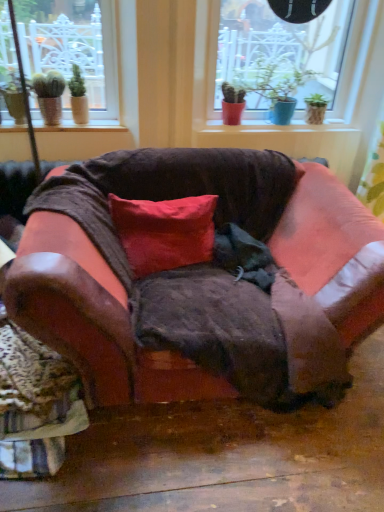
Identify the location of leather couch at center. This screenshot has width=384, height=512. (200, 280).

The height and width of the screenshot is (512, 384). Find the location of `smooth ceramic pots at center, marked as the 1th window sill in a right-to-left arrangement`. smooth ceramic pots at center, marked as the 1th window sill in a right-to-left arrangement is located at coordinates (272, 128).

Where is `leather couch at center`? leather couch at center is located at coordinates (200, 280).

Consider the image. Would you say leather couch at center is inside or outside red cotton pillow at center?

leather couch at center is located beyond the bounds of red cotton pillow at center.

Which is more to the right, leather couch at center or red cotton pillow at center?

From the viewer's perspective, leather couch at center appears more on the right side.

Is leather couch at center with red cotton pillow at center?

No, leather couch at center is not beside red cotton pillow at center.

How different are the orientations of leather couch at center and red cotton pillow at center in degrees?

7.29 degrees separate the facing orientations of leather couch at center and red cotton pillow at center.

Can you confirm if red cotton pillow at center is thinner than matte brown pot at upper left?

In fact, red cotton pillow at center might be wider than matte brown pot at upper left.

This screenshot has width=384, height=512. Identify the location of houseplant on the left of red cotton pillow at center. (78, 97).

How much distance is there between red cotton pillow at center and matte brown pot at upper left?

A distance of 32.49 inches exists between red cotton pillow at center and matte brown pot at upper left.

Does red cotton pillow at center have a smaller size compared to matte brown pot at upper left?

Actually, red cotton pillow at center might be larger than matte brown pot at upper left.

From a real-world perspective, who is located lower, smooth wood window sill at upper left, arranged as the 2th window sill when viewed from the back, or leather-like fabric swivel chair at lower left?

leather-like fabric swivel chair at lower left, from a real-world perspective.

Is smooth wood window sill at upper left, which is the first window sill in front-to-back order, surrounding leather-like fabric swivel chair at lower left?

No, leather-like fabric swivel chair at lower left is located outside of smooth wood window sill at upper left, which is the first window sill in front-to-back order.

Relative to leather-like fabric swivel chair at lower left, is smooth wood window sill at upper left, the 1th window sill in the left-to-right sequence, in front or behind?

In the image, smooth wood window sill at upper left, the 1th window sill in the left-to-right sequence, appears behind leather-like fabric swivel chair at lower left.

Could you measure the distance between smooth wood window sill at upper left, which is the first window sill in front-to-back order, and leather-like fabric swivel chair at lower left?

smooth wood window sill at upper left, which is the first window sill in front-to-back order, is 1.21 meters away from leather-like fabric swivel chair at lower left.

Does point (57, 446) lie in front of point (84, 99)?

Yes, point (57, 446) is closer to viewer.

Would you say matte brown pot at upper left is part of leather-like fabric swivel chair at lower left's contents?

No, leather-like fabric swivel chair at lower left does not contain matte brown pot at upper left.

Between leather-like fabric swivel chair at lower left and matte brown pot at upper left, which one has more height?

With more height is matte brown pot at upper left.

Does leather-like fabric swivel chair at lower left turn towards matte brown pot at upper left?

No, leather-like fabric swivel chair at lower left does not turn towards matte brown pot at upper left.

Looking at this image, which point is more forward, [240,83] or [43,355]?

The point [43,355] is closer to the camera.

I want to click on plant above the leather-like fabric swivel chair at lower left (from a real-world perspective), so click(x=271, y=87).

Does matte red pot at center have a larger size compared to leather-like fabric swivel chair at lower left?

Actually, matte red pot at center might be smaller than leather-like fabric swivel chair at lower left.

Is matte red pot at center inside the boundaries of leather-like fabric swivel chair at lower left, or outside?

matte red pot at center exists outside the volume of leather-like fabric swivel chair at lower left.

Is leather-like fabric swivel chair at lower left at the left side of smooth wood window sill at upper left, the 1th window sill in the left-to-right sequence?

No.

Is leather-like fabric swivel chair at lower left facing away from smooth wood window sill at upper left, the 1th window sill in the left-to-right sequence?

That's not correct — leather-like fabric swivel chair at lower left is not looking away from smooth wood window sill at upper left, the 1th window sill in the left-to-right sequence.

From the image's perspective, who appears lower, leather-like fabric swivel chair at lower left or smooth wood window sill at upper left, which is the first window sill in front-to-back order?

From the image's view, leather-like fabric swivel chair at lower left is below.

Who is taller, leather-like fabric swivel chair at lower left or smooth wood window sill at upper left, the 2th window sill from the right?

leather-like fabric swivel chair at lower left.

Based on their sizes in the image, would you say leather couch at center is bigger or smaller than matte brown pot at upper left?

Considering their sizes, leather couch at center takes up more space than matte brown pot at upper left.

From a real-world perspective, is leather couch at center physically located above or below matte brown pot at upper left?

leather couch at center is below matte brown pot at upper left.

Where is `houseplant to the left of leather couch at center`? This screenshot has width=384, height=512. houseplant to the left of leather couch at center is located at coordinates (78, 97).

There is a leather couch at center. Identify the location of pillow above it (from a real-world perspective). The width and height of the screenshot is (384, 512). (164, 232).

Image resolution: width=384 pixels, height=512 pixels. I want to click on pillow below the matte brown pot at upper left (from a real-world perspective), so click(164, 232).

Based on their spatial positions, is leather-like fabric swivel chair at lower left or smooth ceramic pots at center, which appears as the 2th window sill when viewed from the front, closer to leather couch at center?

leather-like fabric swivel chair at lower left is closer to leather couch at center.

Considering their positions, is matte brown pot at upper left positioned further to red cotton pillow at center than leather-like fabric swivel chair at lower left?

matte brown pot at upper left.

Considering their positions, is smooth wood window sill at upper left, the 2th window sill from the right, positioned closer to matte red pot at center than red cotton pillow at center?

smooth wood window sill at upper left, the 2th window sill from the right, is positioned closer to the anchor matte red pot at center.

When comparing their distances from matte red pot at center, does matte brown pot at upper left or red cotton pillow at center seem closer?

red cotton pillow at center lies closer to matte red pot at center than the other object.

From the image, which object appears to be nearer to smooth wood window sill at upper left, arranged as the 2th window sill when viewed from the back, leather-like fabric swivel chair at lower left or matte brown pot at upper left?

Based on the image, matte brown pot at upper left appears to be nearer to smooth wood window sill at upper left, arranged as the 2th window sill when viewed from the back.

Which object lies further to the anchor point leather-like fabric swivel chair at lower left, matte brown pot at upper left or red cotton pillow at center?

Among the two, matte brown pot at upper left is located further to leather-like fabric swivel chair at lower left.

Which object lies nearer to the anchor point matte brown pot at upper left, smooth wood window sill at upper left, the 2th window sill from the right, or red cotton pillow at center?

smooth wood window sill at upper left, the 2th window sill from the right, is closer to matte brown pot at upper left.

Estimate the real-world distances between objects in this image. Which object is closer to matte brown pot at upper left, smooth ceramic pots at center, which ranks as the second window sill in left-to-right order, or leather couch at center?

smooth ceramic pots at center, which ranks as the second window sill in left-to-right order, is closer to matte brown pot at upper left.

Locate an element on the screen. pillow located between smooth wood window sill at upper left, which is the first window sill in front-to-back order, and matte red pot at center in the left-right direction is located at coordinates (164, 232).

At what (x,y) coordinates should I click in order to perform the action: click on window sill between smooth ceramic pots at center, arranged as the first window sill when viewed from the back, and leather-like fabric swivel chair at lower left from top to bottom. Please return your answer as a coordinate pair (x, y). The height and width of the screenshot is (512, 384). Looking at the image, I should click on (81, 126).

At what (x,y) coordinates should I click in order to perform the action: click on houseplant located between leather couch at center and smooth ceramic pots at center, marked as the 1th window sill in a right-to-left arrangement, in the depth direction. Please return your answer as a coordinate pair (x, y). The image size is (384, 512). Looking at the image, I should click on (78, 97).

Find the location of `pillow between smooth ceramic pots at center, which appears as the 2th window sill when viewed from the front, and leather-like fabric swivel chair at lower left, in the vertical direction`. pillow between smooth ceramic pots at center, which appears as the 2th window sill when viewed from the front, and leather-like fabric swivel chair at lower left, in the vertical direction is located at coordinates (164, 232).